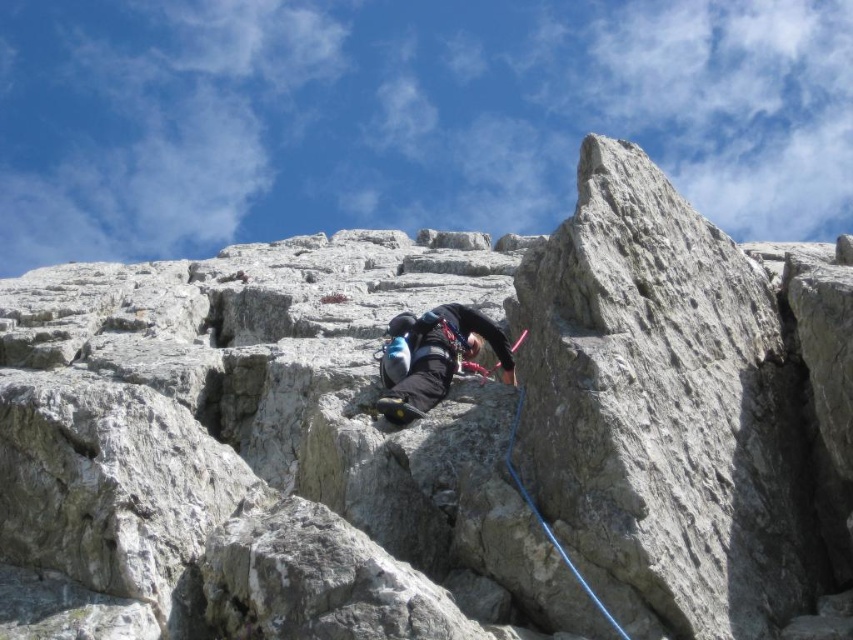
Question: Can you confirm if black fabric helmet at center is positioned to the left of blue rubber rope at center?

Choices:
 (A) no
 (B) yes

Answer: (B)

Question: Which of the following is the closest to the observer?

Choices:
 (A) (392, 410)
 (B) (523, 394)

Answer: (B)

Question: Does black fabric helmet at center have a greater width compared to blue rubber rope at center?

Choices:
 (A) no
 (B) yes

Answer: (B)

Question: Among these objects, which one is farthest from the camera?

Choices:
 (A) black fabric helmet at center
 (B) blue rubber rope at center

Answer: (A)

Question: Which of the following is the closest to the observer?

Choices:
 (A) blue rubber rope at center
 (B) black fabric helmet at center

Answer: (A)

Question: Is black fabric helmet at center smaller than blue rubber rope at center?

Choices:
 (A) yes
 (B) no

Answer: (B)